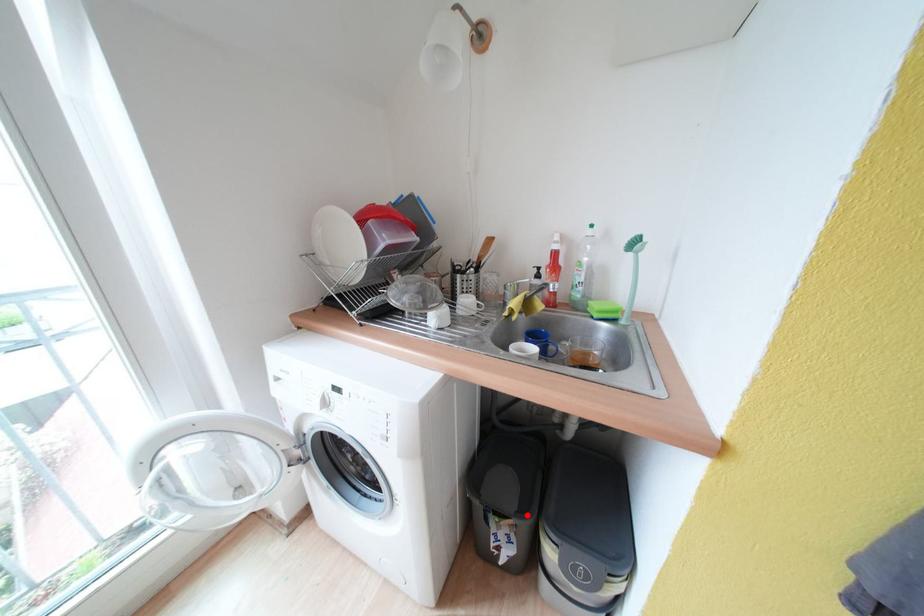
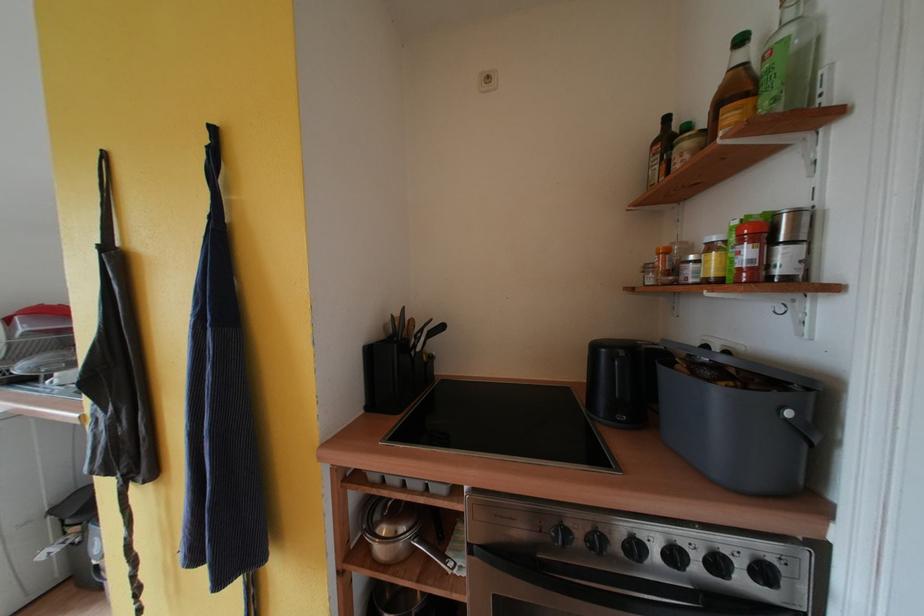
Find the pixel in the second image that matches the highlighted location in the first image.

(83, 517)